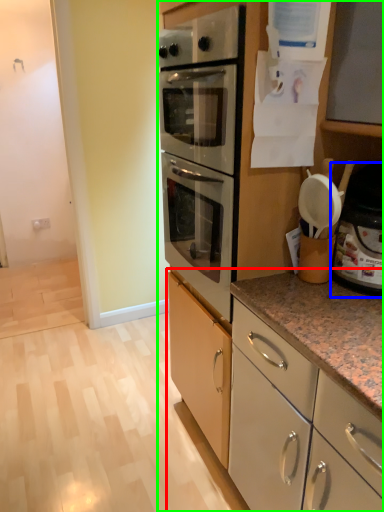
Question: Which object is positioned farthest from cabinetry (highlighted by a red box)? Select from appliance (highlighted by a blue box) and cabinetry (highlighted by a green box).

Choices:
 (A) appliance
 (B) cabinetry

Answer: (A)